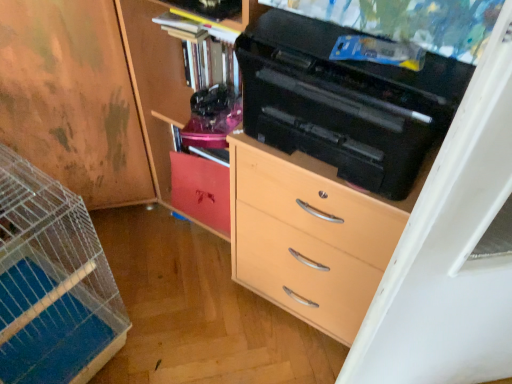
Question: Considering their positions, is matte wood cabinet at center, the 1th cabinetry positioned from the right, located in front of or behind wooden cabinet at left, the 3th cabinetry from the right?

Choices:
 (A) front
 (B) behind

Answer: (A)

Question: From their relative heights in the image, would you say matte wood cabinet at center, the 1th cabinetry positioned from the right, is taller or shorter than wooden cabinet at left, which appears as the 1th cabinetry when viewed from the left?

Choices:
 (A) tall
 (B) short

Answer: (A)

Question: Which of these objects is positioned closest to the matte wood cabinet at center, the 3th cabinetry when ordered from left to right?

Choices:
 (A) matte wood chest of drawers at center
 (B) matte wood cabinet at center, arranged as the second cabinetry when viewed from the right
 (C) wooden cabinet at left, the 3th cabinetry from the right

Answer: (B)

Question: Which is farther from the matte wood cabinet at center, the 3th cabinetry when ordered from left to right?

Choices:
 (A) matte wood chest of drawers at center
 (B) matte wood cabinet at center, arranged as the second cabinetry when viewed from the right
 (C) wooden cabinet at left, which appears as the 1th cabinetry when viewed from the left

Answer: (A)